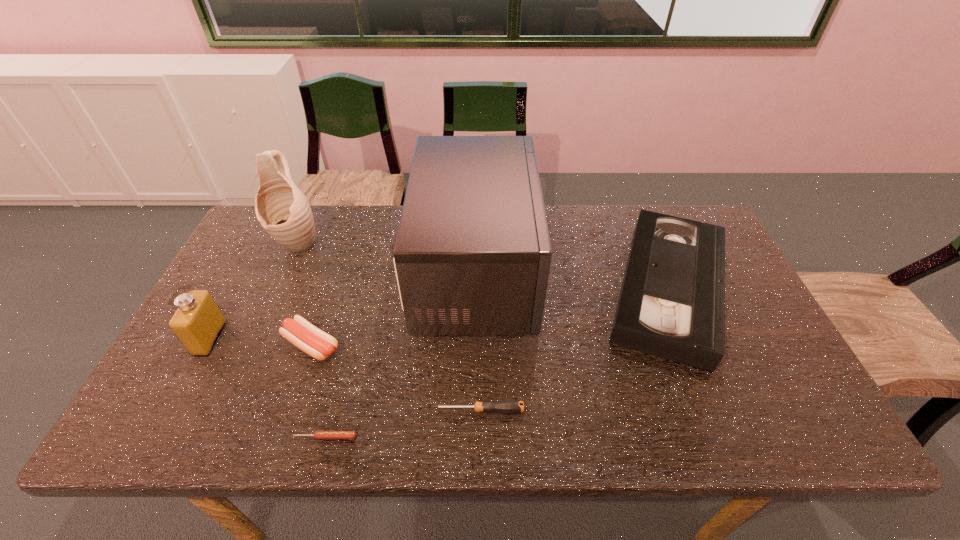
This screenshot has width=960, height=540. In order to click on free region at the near edge in this screenshot , I will do `click(505, 428)`.

You are a GUI agent. You are given a task and a screenshot of the screen. Output one action in this format:
    pyautogui.click(x=<x>, y=<y>)
    Task: Click on the free point at the right edge
    The height and width of the screenshot is (540, 960).
    Given the screenshot: What is the action you would take?
    pyautogui.click(x=755, y=384)

You are a GUI agent. You are given a task and a screenshot of the screen. Output one action in this format:
    pyautogui.click(x=<x>, y=<y>)
    Task: Click on the vacant point located between the shorter sausage and the second shortest object
    
    Given the screenshot: What is the action you would take?
    pyautogui.click(x=402, y=424)

Where is `free area in between the fourth shortest object and the microwave oven`? free area in between the fourth shortest object and the microwave oven is located at coordinates tap(572, 280).

Find the location of a particular element. This screenshot has height=540, width=960. vacant space that is in between the second shortest object and the pitcher is located at coordinates (388, 327).

This screenshot has height=540, width=960. Find the location of `free space between the nearer sausage and the microwave oven`. free space between the nearer sausage and the microwave oven is located at coordinates (401, 354).

In order to click on vacant space that is in between the rightmost object and the shortest object in this screenshot , I will do `click(497, 363)`.

Find the location of a particular element. This screenshot has height=540, width=960. vacant area that lies between the third tallest object and the microwave oven is located at coordinates (344, 305).

Where is `unoccupied position between the taller sausage and the shorter sausage`? This screenshot has width=960, height=540. unoccupied position between the taller sausage and the shorter sausage is located at coordinates (319, 391).

You are a GUI agent. You are given a task and a screenshot of the screen. Output one action in this format:
    pyautogui.click(x=<x>, y=<y>)
    Task: Click on the free space between the nearer sausage and the rightmost object
    Image resolution: width=960 pixels, height=540 pixels.
    Given the screenshot: What is the action you would take?
    pyautogui.click(x=497, y=363)